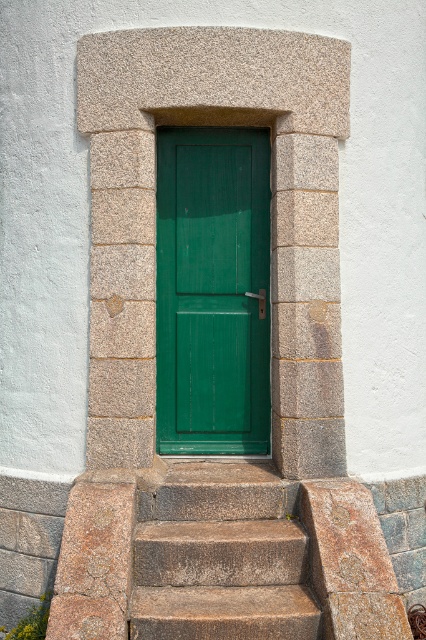
Who is shorter, green wooden door at center or granite steps at center?

granite steps at center is shorter.

Identify the location of green wooden door at center. (213, 291).

Identify the location of green wooden door at center. The image size is (426, 640). (213, 291).